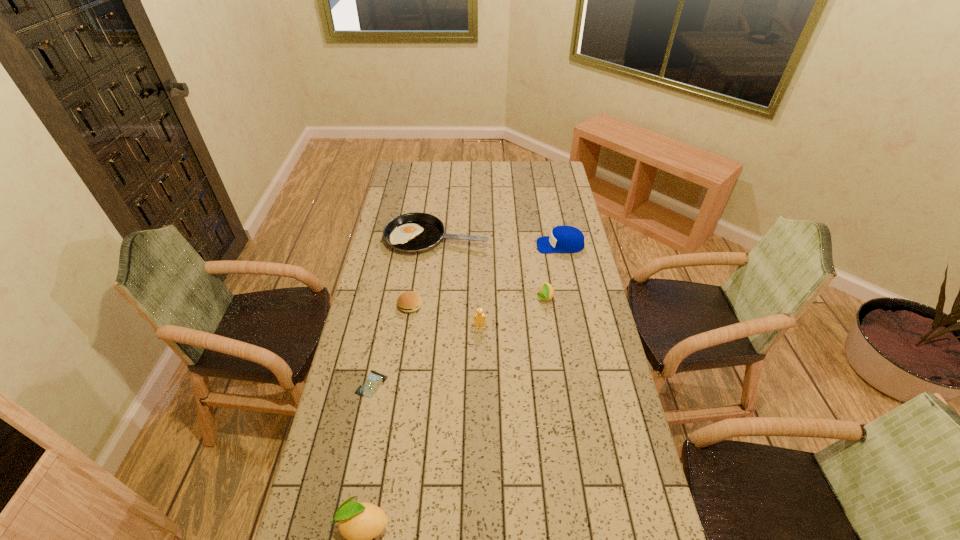
If the aim is uniform spacing by inserting an additional lemon among them, please point to a vacant space for this new lemon. Please provide its 2D coordinates. Your answer should be formatted as a tuple, i.e. [(x, y)], where the tuple contains the x and y coordinates of a point satisfying the conditions above.

[(472, 388)]